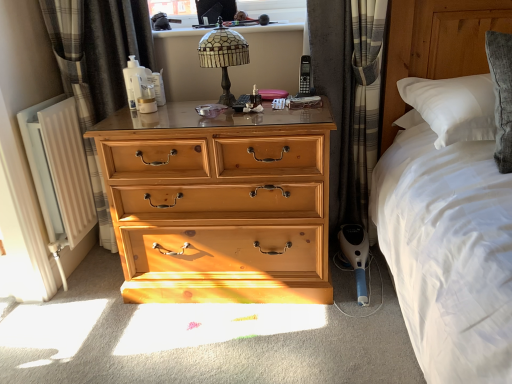
Question: From the image's perspective, is stained glass lampshade at upper center located above or below wooden chest of drawers at center?

Choices:
 (A) above
 (B) below

Answer: (A)

Question: Relative to wooden chest of drawers at center, is stained glass lampshade at upper center in front or behind?

Choices:
 (A) behind
 (B) front

Answer: (A)

Question: Which is nearer to the stained glass lampshade at upper center?

Choices:
 (A) white painted metal radiator at left
 (B) gray plaid curtain at left, which appears as the 2th curtain when viewed from the right
 (C) plaid fabric curtain at right, the first curtain viewed from the right
 (D) black plastic remote control at center
 (E) wooden chest of drawers at center

Answer: (D)

Question: Estimate the real-world distances between objects in this image. Which object is closer to the black plastic remote control at center?

Choices:
 (A) stained glass lampshade at upper center
 (B) gray plaid curtain at left, which appears as the 2th curtain when viewed from the right
 (C) white painted metal radiator at left
 (D) plaid fabric curtain at right, the first curtain viewed from the right
 (E) wooden chest of drawers at center

Answer: (A)